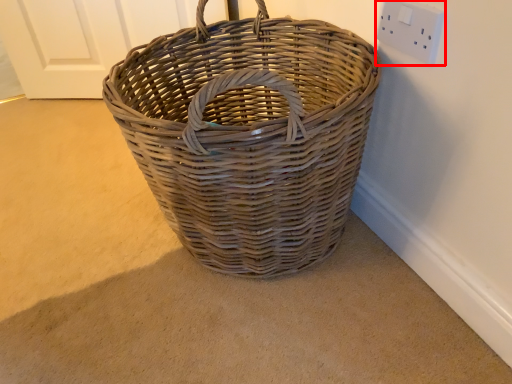
Question: From the image's perspective, what is the correct spatial positioning of electric outlet (annotated by the red box) in reference to picnic basket?

Choices:
 (A) above
 (B) below

Answer: (A)